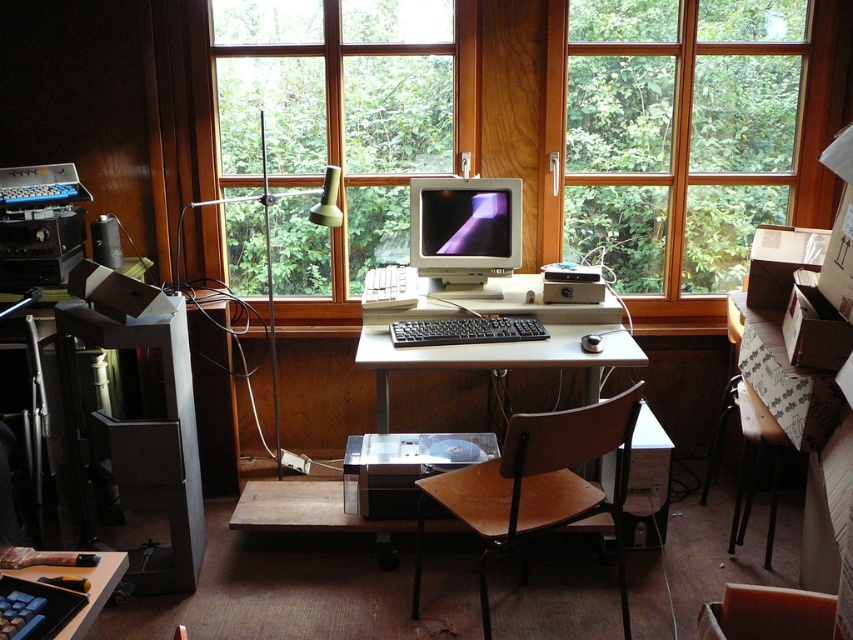
Describe the element at coordinates (465, 230) in the screenshot. I see `matte gray monitor at center` at that location.

Does matte gray monitor at center have a greater height compared to matte silver monitor at center?

Yes.

In order to click on matte gray monitor at center in this screenshot , I will do `click(465, 230)`.

Consider the image. Is black plastic printer at center above matte silver monitor at center?

Incorrect, black plastic printer at center is not positioned above matte silver monitor at center.

Who is shorter, black plastic printer at center or matte silver monitor at center?

Standing shorter between the two is matte silver monitor at center.

Is point (480, 435) positioned in front of point (430, 225)?

That is True.

At what (x,y) coordinates should I click in order to perform the action: click on black plastic printer at center. Please return your answer as a coordinate pair (x, y). The width and height of the screenshot is (853, 640). Looking at the image, I should click on (403, 467).

Based on the photo, is matte silver monitor at center smaller than black plastic keyboard at lower left?

Indeed, matte silver monitor at center has a smaller size compared to black plastic keyboard at lower left.

Is matte silver monitor at center to the left of black plastic keyboard at lower left from the viewer's perspective?

In fact, matte silver monitor at center is to the right of black plastic keyboard at lower left.

Find the location of a particular element. matte silver monitor at center is located at coordinates (465, 221).